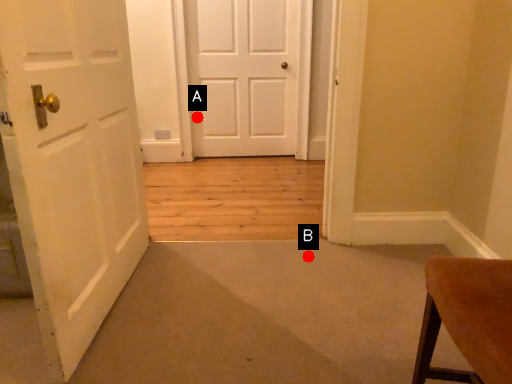
Question: Two points are circled on the image, labeled by A and B beside each circle. Which point is farther from the camera taking this photo?

Choices:
 (A) A is further
 (B) B is further

Answer: (A)